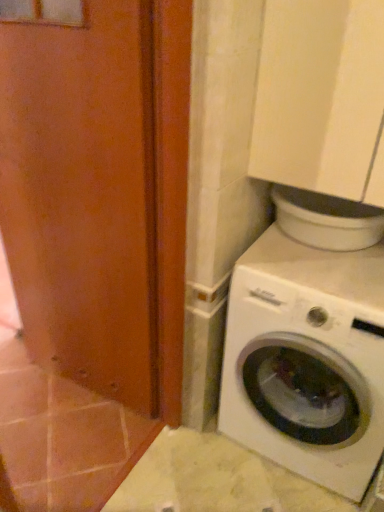
Question: In terms of height, does white matte washing machine at lower right look taller or shorter compared to matte orange screen door at left?

Choices:
 (A) tall
 (B) short

Answer: (B)

Question: Is white matte washing machine at lower right in front of or behind matte orange screen door at left in the image?

Choices:
 (A) front
 (B) behind

Answer: (B)

Question: Is point (284, 462) positioned closer to the camera than point (119, 55)?

Choices:
 (A) closer
 (B) farther

Answer: (B)

Question: From the image's perspective, is matte orange screen door at left positioned above or below white matte washing machine at lower right?

Choices:
 (A) above
 (B) below

Answer: (A)

Question: Based on their positions, is matte orange screen door at left located to the left or right of white matte washing machine at lower right?

Choices:
 (A) left
 (B) right

Answer: (A)

Question: Is matte orange screen door at left in front of or behind white matte washing machine at lower right in the image?

Choices:
 (A) front
 (B) behind

Answer: (A)

Question: From a real-world perspective, is matte orange screen door at left physically located above or below white matte washing machine at lower right?

Choices:
 (A) below
 (B) above

Answer: (B)